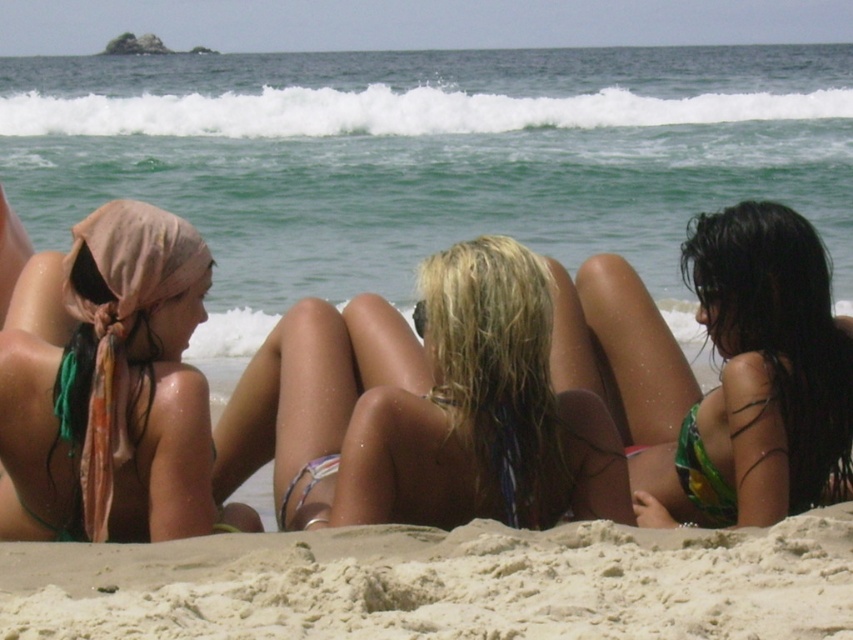
Based on the photo, you are a photographer standing on the beach and want to capture a closeup of both the matte pink headscarf at left and the multicolored fabric bikini at center. Given that your camera has a maximum focus range of 18 inches, will you be able to include both objects in the same frame without moving closer?

The matte pink headscarf at left is 18.74 inches from the multicolored fabric bikini at center. Since the distance between them exceeds the camera maximum focus range of 18 inches, you cannot capture both in the same frame without moving closer.

You are standing on the beach and see two points marked on the sand. The first point is at coordinate point(102, 502) and the second is at point(317, 465). Which point is closer to you?

Point(102, 502) is closer to you than point(317, 465).